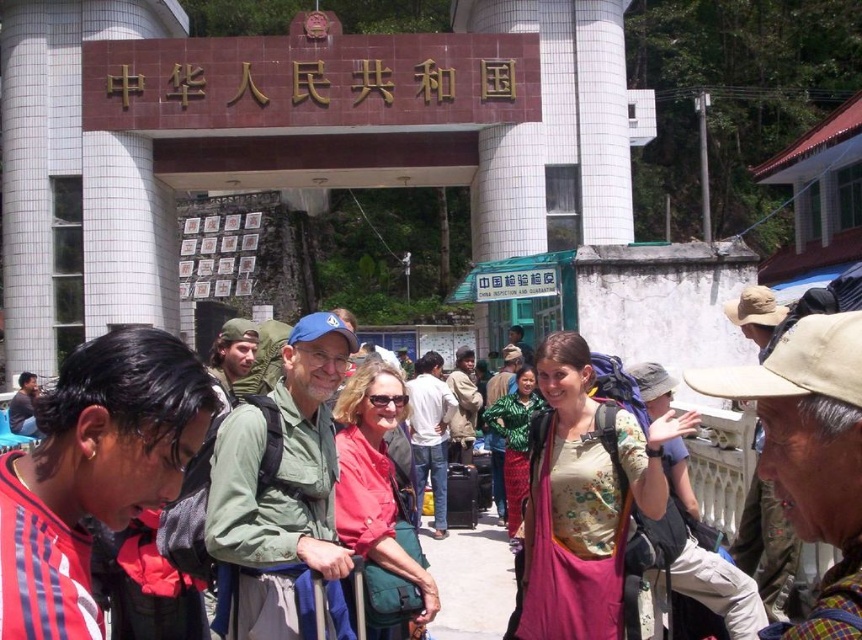
Question: Estimate the real-world distances between objects in this image. Which object is closer to the denim jacket at center?

Choices:
 (A) floral-patterned shirt at center
 (B) red matte jacket at center

Answer: (B)

Question: Is the position of green fabric jacket at center more distant than that of khaki fabric jacket at center?

Choices:
 (A) yes
 (B) no

Answer: (B)

Question: Which object appears closest to the camera in this image?

Choices:
 (A) green floral dress at center
 (B) green fabric jacket at center
 (C) khaki fabric jacket at center
 (D) red matte jacket at lower left

Answer: (D)

Question: Which point is farther to the camera?

Choices:
 (A) printed cotton shirt at center
 (B) red matte jacket at lower left

Answer: (A)

Question: Considering the relative positions of red matte jacket at lower left and red matte jacket at center in the image provided, where is red matte jacket at lower left located with respect to red matte jacket at center?

Choices:
 (A) below
 (B) above

Answer: (B)

Question: Does red matte jacket at lower left have a greater width compared to green fabric jacket at center?

Choices:
 (A) no
 (B) yes

Answer: (B)